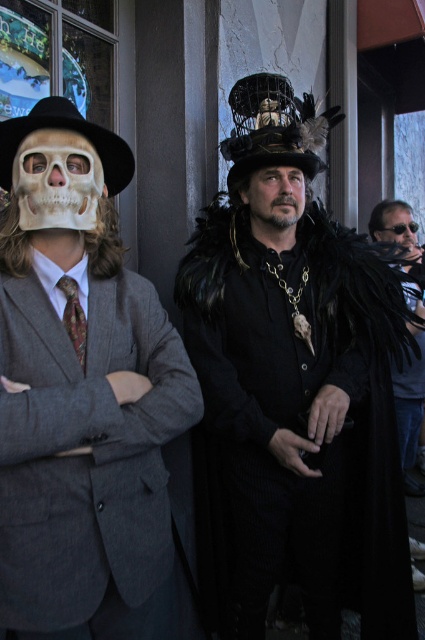
You are a photographer setting up for an event and notice the shiny black feathered hat at center and the matte black sunglasses at upper right in the frame. Which object would you need to adjust your camera angle to capture fully without cropping, and why?

The shiny black feathered hat at center might be wider than matte black sunglasses at upper right, so you would need to adjust your camera angle to capture the hat fully without cropping.

You are a photographer at the event and want to ensure both the shiny black feathered hat at center and the black velvet cape at right are visible in your photo. Based on their positions, which object is higher up in the image?

The shiny black feathered hat at center is located above the black velvet cape at right, so it is higher up in the image.

You are a photographer at the event and need to position the black velvet cape at right and the bearded man at center in a group photo. Which object should be placed closer to the camera to ensure both are in focus?

The black velvet cape at right is bigger than the bearded man at center, so placing the bearded man at center closer to the camera will help keep both in focus since the smaller object can be positioned nearer to maintain focus depth.